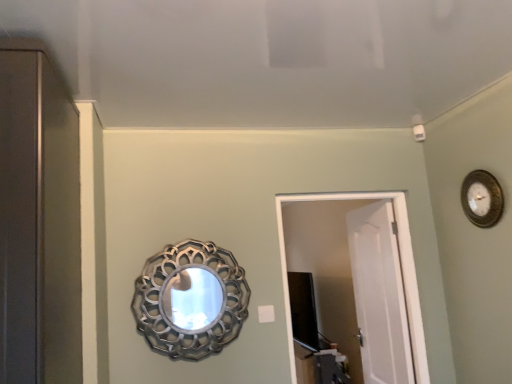
Question: Does metallic silver mirror at center contain white matte door at center, acting as the second door starting from the front?

Choices:
 (A) yes
 (B) no

Answer: (B)

Question: Is metallic silver mirror at center positioned before white matte door at center, acting as the second door starting from the front?

Choices:
 (A) yes
 (B) no

Answer: (A)

Question: Could you tell me if metallic silver mirror at center is facing white matte door at center, acting as the second door starting from the front?

Choices:
 (A) yes
 (B) no

Answer: (B)

Question: Is metallic silver mirror at center next to white matte door at center, the first door in the back-to-front sequence?

Choices:
 (A) yes
 (B) no

Answer: (B)

Question: Are metallic silver mirror at center and white matte door at center, acting as the second door starting from the front, far apart?

Choices:
 (A) yes
 (B) no

Answer: (A)

Question: From a real-world perspective, is gold textured clock at upper right positioned above or below white plastic light switch at center?

Choices:
 (A) above
 (B) below

Answer: (A)

Question: In terms of size, does gold textured clock at upper right appear bigger or smaller than white plastic light switch at center?

Choices:
 (A) small
 (B) big

Answer: (B)

Question: From their relative heights in the image, would you say gold textured clock at upper right is taller or shorter than white plastic light switch at center?

Choices:
 (A) tall
 (B) short

Answer: (A)

Question: Considering their positions, is gold textured clock at upper right located in front of or behind white plastic light switch at center?

Choices:
 (A) front
 (B) behind

Answer: (A)

Question: Is white matte door at center, acting as the second door starting from the front, taller or shorter than gold textured clock at upper right?

Choices:
 (A) short
 (B) tall

Answer: (B)

Question: Does point (399, 327) appear closer or farther from the camera than point (474, 173)?

Choices:
 (A) closer
 (B) farther

Answer: (B)

Question: From a real-world perspective, is white matte door at center, acting as the second door starting from the front, physically located above or below gold textured clock at upper right?

Choices:
 (A) above
 (B) below

Answer: (B)

Question: In the image, is white matte door at center, the first door in the back-to-front sequence, positioned in front of or behind gold textured clock at upper right?

Choices:
 (A) front
 (B) behind

Answer: (B)

Question: From a real-world perspective, relative to white matte door at center, acting as the second door starting from the front, is black glossy tv at center vertically above or below?

Choices:
 (A) above
 (B) below

Answer: (B)

Question: Does point (297, 317) appear closer or farther from the camera than point (375, 296)?

Choices:
 (A) farther
 (B) closer

Answer: (A)